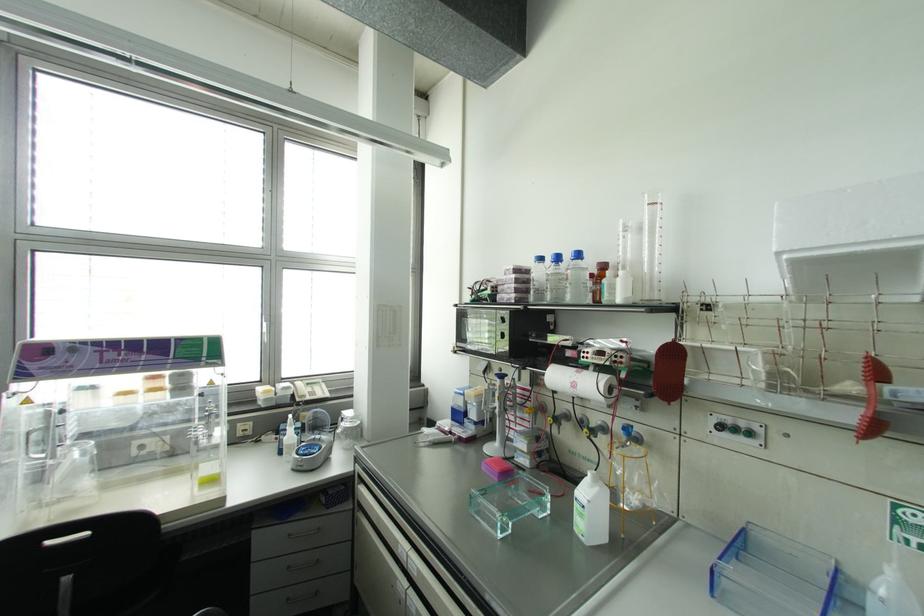
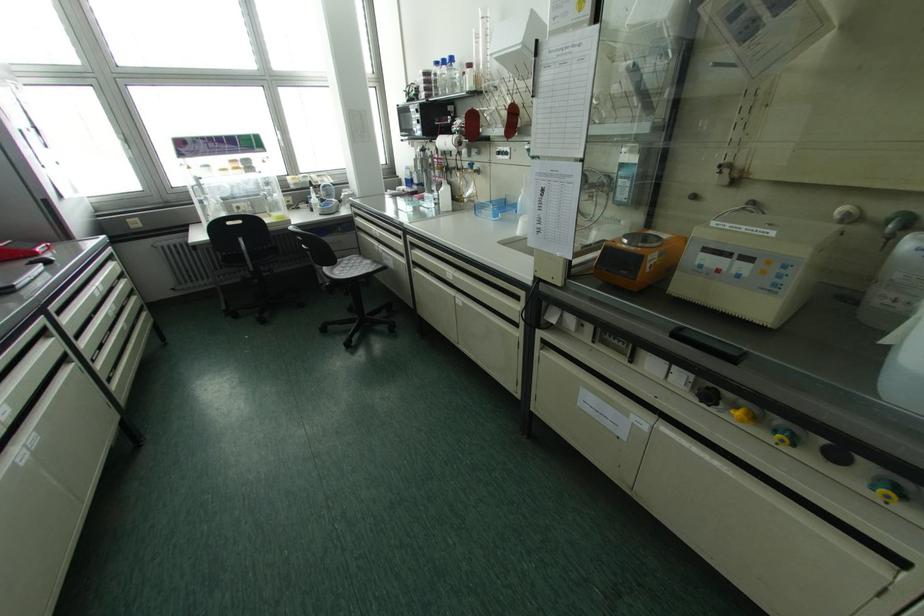
Locate, in the second image, the point that corresponds to pixel 608 491 in the first image.

(448, 187)